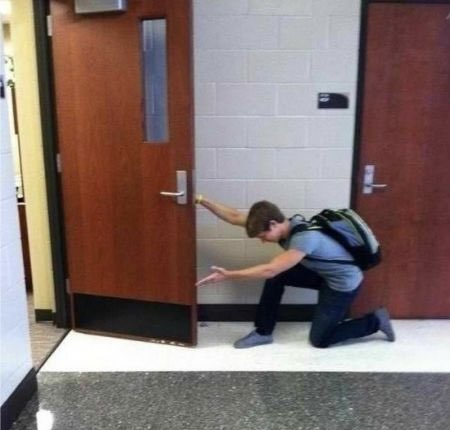
Identify the location of door window. The height and width of the screenshot is (430, 450). (159, 60), (159, 360).